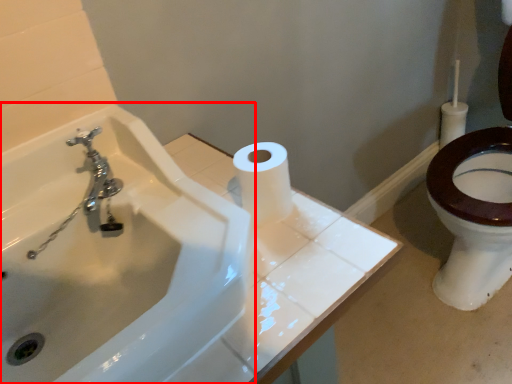
Question: In this image, where is sink (annotated by the red box) located relative to toilet paper?

Choices:
 (A) right
 (B) left

Answer: (B)